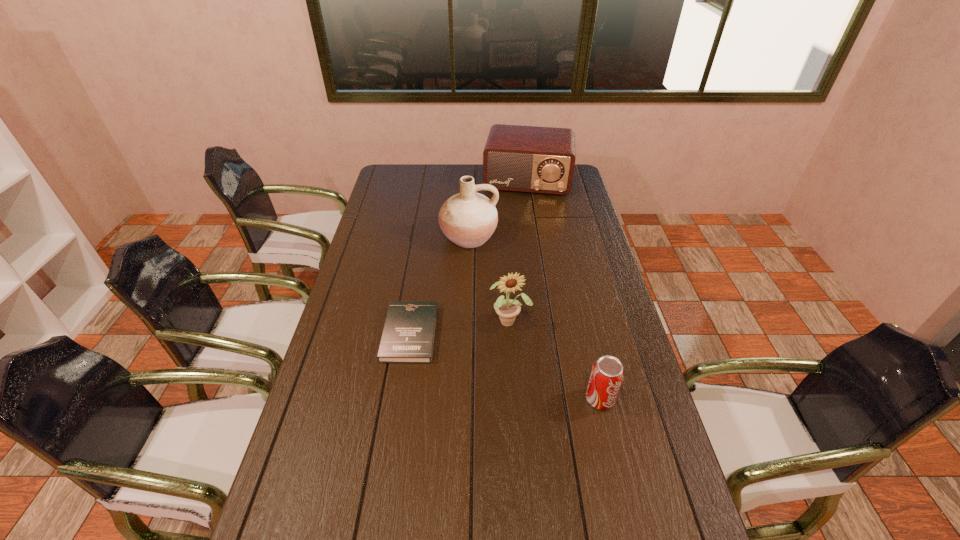
Where is `object at the far right corner`? The width and height of the screenshot is (960, 540). object at the far right corner is located at coordinates (534, 159).

Where is `vacant space at the far edge`? The height and width of the screenshot is (540, 960). vacant space at the far edge is located at coordinates (448, 173).

Identify the location of free space at the left edge of the desktop. The image size is (960, 540). (365, 227).

This screenshot has height=540, width=960. In order to click on vacant space at the right edge in this screenshot , I will do `click(562, 233)`.

Where is `vacant area that lies between the shortest object and the second farthest object`? vacant area that lies between the shortest object and the second farthest object is located at coordinates (440, 285).

Where is `vacant region between the sunflower and the fourth nearest object`? vacant region between the sunflower and the fourth nearest object is located at coordinates pos(489,279).

This screenshot has height=540, width=960. In order to click on empty location between the sunflower and the fourth nearest object in this screenshot , I will do `click(489, 279)`.

What are the coordinates of `vacant region between the shortest object and the pottery` in the screenshot? It's located at (440, 285).

Image resolution: width=960 pixels, height=540 pixels. I want to click on free spot between the radio receiver and the second farthest object, so 498,209.

Locate an element on the screen. The width and height of the screenshot is (960, 540). vacant area that lies between the sunflower and the book is located at coordinates (460, 327).